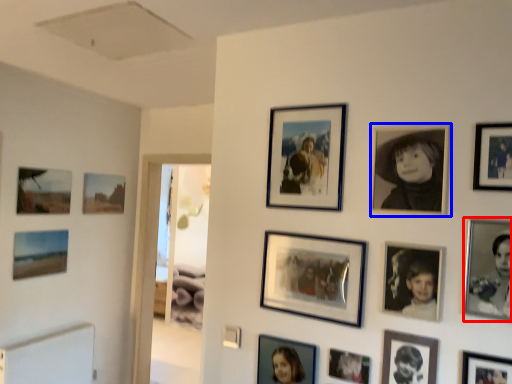
Question: Which object is further to the camera taking this photo, picture frame (highlighted by a red box) or picture frame (highlighted by a blue box)?

Choices:
 (A) picture frame
 (B) picture frame

Answer: (B)